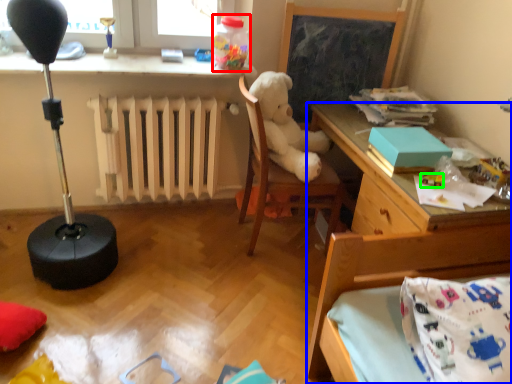
Question: Estimate the real-world distances between objects in this image. Which object is farther from toy (highlighted by a red box), desk (highlighted by a blue box) or toy (highlighted by a green box)?

Choices:
 (A) desk
 (B) toy

Answer: (B)